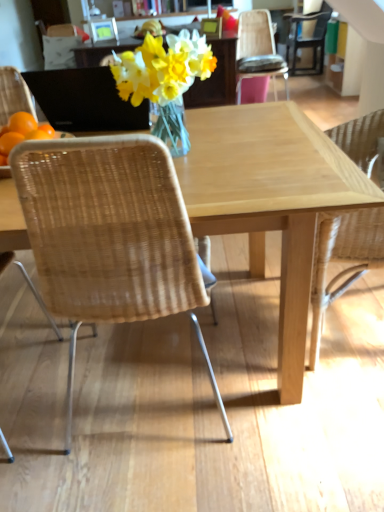
In order to click on matte black chair at upper right, the 4th chair when ordered from bottom to top in this screenshot , I will do `click(307, 38)`.

Find the location of `natural wood table at center`. natural wood table at center is located at coordinates (270, 200).

What is the approximate height of woven wood chair at upper right, positioned as the second chair in back-to-front order?

woven wood chair at upper right, positioned as the second chair in back-to-front order, is 84.45 centimeters tall.

What do you see at coordinates (343, 260) in the screenshot?
I see `natural wicker chair at right, the second chair positioned from the bottom` at bounding box center [343, 260].

Measure the distance between translucent glass vase at center and camera.

A distance of 3.49 feet exists between translucent glass vase at center and camera.

This screenshot has height=512, width=384. I want to click on matte black chair at upper right, the 4th chair when ordered from bottom to top, so click(x=307, y=38).

Considering the relative sizes of natural wood table at center and matte black chair at upper right, which is the first chair from right to left, in the image provided, is natural wood table at center shorter than matte black chair at upper right, which is the first chair from right to left,?

Indeed, natural wood table at center has a lesser height compared to matte black chair at upper right, which is the first chair from right to left.

Does natural wood table at center come in front of matte black chair at upper right, which is the 1th chair from back to front?

Yes, it is.

From a real-world perspective, which is physically below, natural wood table at center or matte black chair at upper right, which is counted as the 4th chair, starting from the front?

In real-world perspective, natural wood table at center is lower.

What are the coordinates of `laptop that appears below the translucent glass vase at center (from the image's perspective)` in the screenshot? It's located at point(85,100).

Is black matte laptop at upper left next to translucent glass vase at center?

No, black matte laptop at upper left is not next to translucent glass vase at center.

Is point (75, 117) positioned in front of point (202, 45)?

No, it is behind (202, 45).

Is black matte laptop at upper left oriented away from translucent glass vase at center?

That's not correct — black matte laptop at upper left is not looking away from translucent glass vase at center.

Find the location of a particular element. the 1st chair above the black matte laptop at upper left (from the image's perspective) is located at coordinates (258, 51).

Is woven wood chair at upper right, placed as the 3th chair when sorted from left to right, aimed at black matte laptop at upper left?

Yes, woven wood chair at upper right, placed as the 3th chair when sorted from left to right, is facing black matte laptop at upper left.

From the image's perspective, is woven wood chair at upper right, positioned as the second chair in top-to-bottom order, on top of black matte laptop at upper left?

Yes, from the image's perspective, woven wood chair at upper right, positioned as the second chair in top-to-bottom order, is over black matte laptop at upper left.

Between woven wood chair at upper right, which is counted as the 3th chair, starting from the bottom, and black matte laptop at upper left, which one has smaller size?

black matte laptop at upper left is smaller.

The width and height of the screenshot is (384, 512). I want to click on chair that is the 1st object to the left of the woven wood chair at upper right, which is counted as the 3th chair, starting from the bottom, starting at the anchor, so click(343, 260).

Is woven wood chair at upper right, positioned as the second chair in back-to-front order, positioned beyond the bounds of natural wicker chair at right, the second chair positioned from the bottom?

Yes, woven wood chair at upper right, positioned as the second chair in back-to-front order, is outside of natural wicker chair at right, the second chair positioned from the bottom.

Is woven wood chair at upper right, which is counted as the 3th chair, starting from the bottom, oriented towards natural wicker chair at right, the third chair positioned from the right?

Yes, woven wood chair at upper right, which is counted as the 3th chair, starting from the bottom, is aimed at natural wicker chair at right, the third chair positioned from the right.

Could you measure the distance between woven wood chair at upper right, positioned as the second chair in back-to-front order, and natural wicker chair at right, positioned as the third chair in top-to-bottom order?

The distance of woven wood chair at upper right, positioned as the second chair in back-to-front order, from natural wicker chair at right, positioned as the third chair in top-to-bottom order, is 3.13 meters.

In the scene shown: Can we say matte black chair at upper right, which is counted as the 4th chair, starting from the front, lies outside natural wood table at center?

matte black chair at upper right, which is counted as the 4th chair, starting from the front, lies outside natural wood table at center's area.

Which point is more distant from viewer, (288, 16) or (4, 193)?

The point (288, 16) is farther.

From the image's perspective, is matte black chair at upper right, which is the first chair from right to left, over natural wood table at center?

Yes.

Considering the relative positions of matte black chair at upper right, which is the first chair from right to left, and natural wood table at center in the image provided, is matte black chair at upper right, which is the first chair from right to left, to the left of natural wood table at center from the viewer's perspective?

No.

Is woven wood chair at upper right, which is counted as the 3th chair, starting from the bottom, situated inside woven wood chair at left, which ranks as the 1th chair in bottom-to-top order, or outside?

woven wood chair at upper right, which is counted as the 3th chair, starting from the bottom, exists outside the volume of woven wood chair at left, which ranks as the 1th chair in bottom-to-top order.

Which object is closer to the camera, woven wood chair at upper right, positioned as the second chair in back-to-front order, or woven wood chair at left, acting as the fourth chair starting from the back?

woven wood chair at left, acting as the fourth chair starting from the back, is in front.

Is woven wood chair at upper right, positioned as the second chair in back-to-front order, oriented away from woven wood chair at left, acting as the fourth chair starting from the back?

No, woven wood chair at upper right, positioned as the second chair in back-to-front order, is not facing away from woven wood chair at left, acting as the fourth chair starting from the back.

Considering the relative sizes of woven wood chair at upper right, acting as the 2th chair starting from the right, and woven wood chair at left, which is counted as the fourth chair, starting from the top, in the image provided, is woven wood chair at upper right, acting as the 2th chair starting from the right, smaller than woven wood chair at left, which is counted as the fourth chair, starting from the top,?

Yes.

In the image, is translucent glass vase at center on the left side or the right side of matte black chair at upper right, the 1th chair viewed from the top?

From the image, it's evident that translucent glass vase at center is to the left of matte black chair at upper right, the 1th chair viewed from the top.

From the image's perspective, is translucent glass vase at center positioned above or below matte black chair at upper right, the 4th chair when ordered from bottom to top?

translucent glass vase at center is below matte black chair at upper right, the 4th chair when ordered from bottom to top.

Locate an element on the screen. The image size is (384, 512). chair that is the 3rd object above the natural wood table at center (from a real-world perspective) is located at coordinates (307, 38).

What are the coordinates of `laptop below the translucent glass vase at center (from the image's perspective)` in the screenshot? It's located at (85, 100).

From the image, which object appears to be nearer to natural wood table at center, translucent glass vase at center or natural wicker chair at right, positioned as the third chair in top-to-bottom order?

Among the two, natural wicker chair at right, positioned as the third chair in top-to-bottom order, is located nearer to natural wood table at center.

When comparing their distances from natural wood table at center, does woven wood chair at left, which ranks as the 4th chair in right-to-left order, or black matte laptop at upper left seem further?

black matte laptop at upper left is further to natural wood table at center.

Looking at this image, estimate the real-world distances between objects in this image. Which object is closer to woven wood chair at left, which ranks as the 1th chair in bottom-to-top order, black matte laptop at upper left or translucent glass vase at center?

Among the two, translucent glass vase at center is located nearer to woven wood chair at left, which ranks as the 1th chair in bottom-to-top order.

When comparing their distances from natural wood table at center, does black matte laptop at upper left or woven wood chair at left, the 1th chair from the front, seem further?

The object further to natural wood table at center is black matte laptop at upper left.

Looking at the image, which one is located closer to matte black chair at upper right, which is counted as the 4th chair, starting from the front, woven wood chair at left, the 1th chair from the front, or translucent glass vase at center?

translucent glass vase at center is positioned closer to the anchor matte black chair at upper right, which is counted as the 4th chair, starting from the front.

Considering their positions, is woven wood chair at upper right, acting as the 2th chair starting from the right, positioned further to woven wood chair at left, which is counted as the fourth chair, starting from the top, than natural wood table at center?

woven wood chair at upper right, acting as the 2th chair starting from the right, is further to woven wood chair at left, which is counted as the fourth chair, starting from the top.

Considering their positions, is natural wicker chair at right, acting as the second chair starting from the left, positioned further to black matte laptop at upper left than translucent glass vase at center?

natural wicker chair at right, acting as the second chair starting from the left, is further to black matte laptop at upper left.

Based on the photo, which object lies nearer to the anchor point woven wood chair at left, which is counted as the fourth chair, starting from the top, woven wood chair at upper right, positioned as the second chair in top-to-bottom order, or black matte laptop at upper left?

black matte laptop at upper left is positioned closer to the anchor woven wood chair at left, which is counted as the fourth chair, starting from the top.

Find the location of `flower positioned between natural wood table at center and matte black chair at upper right, which is the 1th chair from back to front, from near to far`. flower positioned between natural wood table at center and matte black chair at upper right, which is the 1th chair from back to front, from near to far is located at coordinates (162, 68).

Locate an element on the screen. The image size is (384, 512). flower positioned between woven wood chair at upper right, positioned as the second chair in back-to-front order, and matte black chair at upper right, the 1th chair viewed from the top, from near to far is located at coordinates (162, 68).

Find the location of a particular element. This screenshot has height=512, width=384. laptop positioned between natural wicker chair at right, placed as the third chair when sorted from back to front, and woven wood chair at upper right, placed as the 3th chair when sorted from left to right, from near to far is located at coordinates (85, 100).

Identify the location of laptop between natural wicker chair at right, positioned as the third chair in top-to-bottom order, and matte black chair at upper right, the 1th chair viewed from the top, along the z-axis. [x=85, y=100].